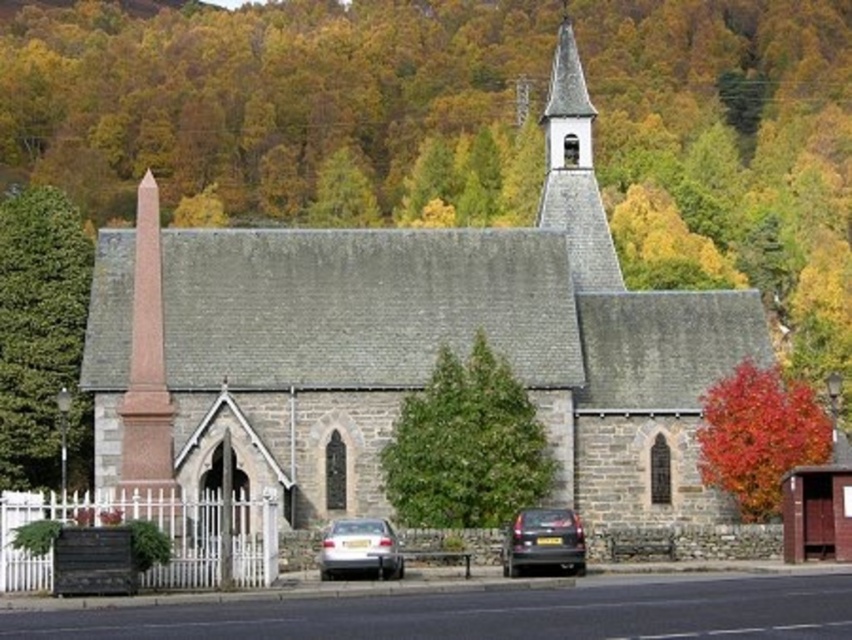
Question: Which object is farther from the camera taking this photo?

Choices:
 (A) shiny black car at center
 (B) autumn leaves at right

Answer: (B)

Question: Is green leafy tree at center above pink polished stone obelisk at left?

Choices:
 (A) yes
 (B) no

Answer: (B)

Question: Which of the following is the closest to the observer?

Choices:
 (A) (720, 444)
 (B) (157, 348)

Answer: (B)

Question: Does green leafy tree at left appear under pink polished stone obelisk at left?

Choices:
 (A) yes
 (B) no

Answer: (A)

Question: Among these objects, which one is nearest to the camera?

Choices:
 (A) green leafy tree at center
 (B) silver metallic car at lower center
 (C) pink polished stone obelisk at left
 (D) autumn leaves at right

Answer: (C)

Question: Can you confirm if autumn leaves at right is positioned to the left of smooth gray steeple at upper center?

Choices:
 (A) no
 (B) yes

Answer: (A)